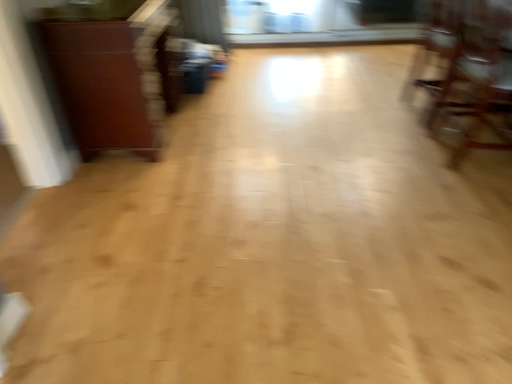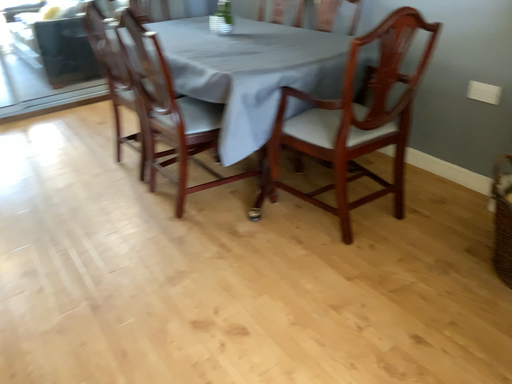
Question: How did the camera likely rotate when shooting the video?

Choices:
 (A) rotated left
 (B) rotated right

Answer: (B)